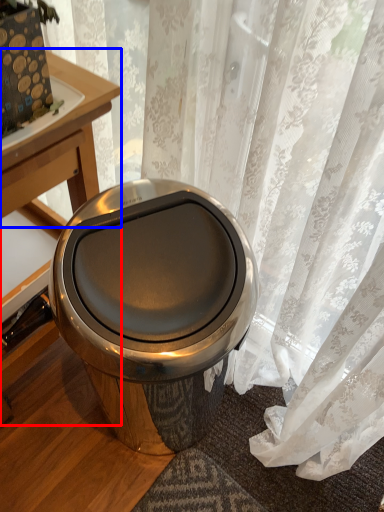
Question: Among these objects, which one is nearest to the camera, table (highlighted by a red box) or round table (highlighted by a blue box)?

Choices:
 (A) table
 (B) round table

Answer: (A)